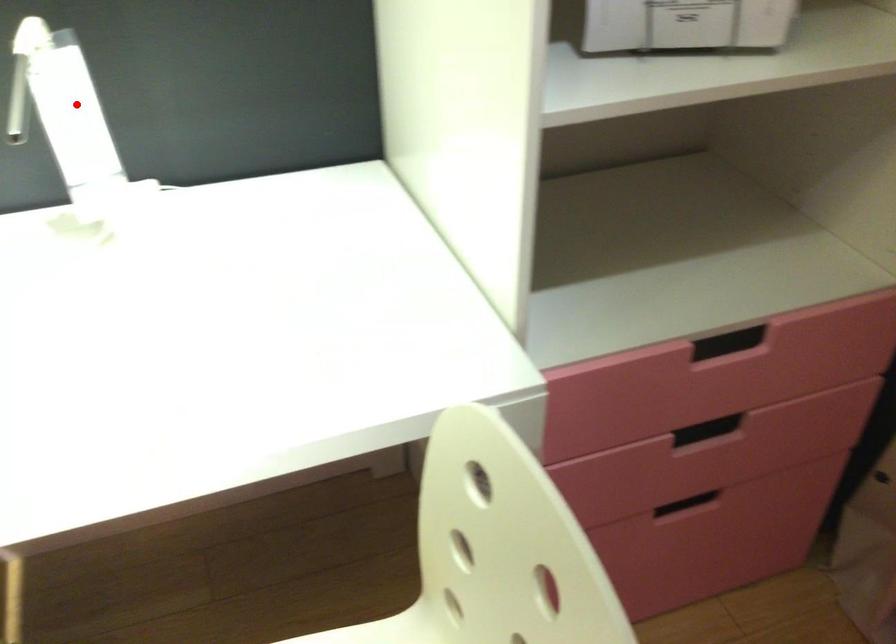
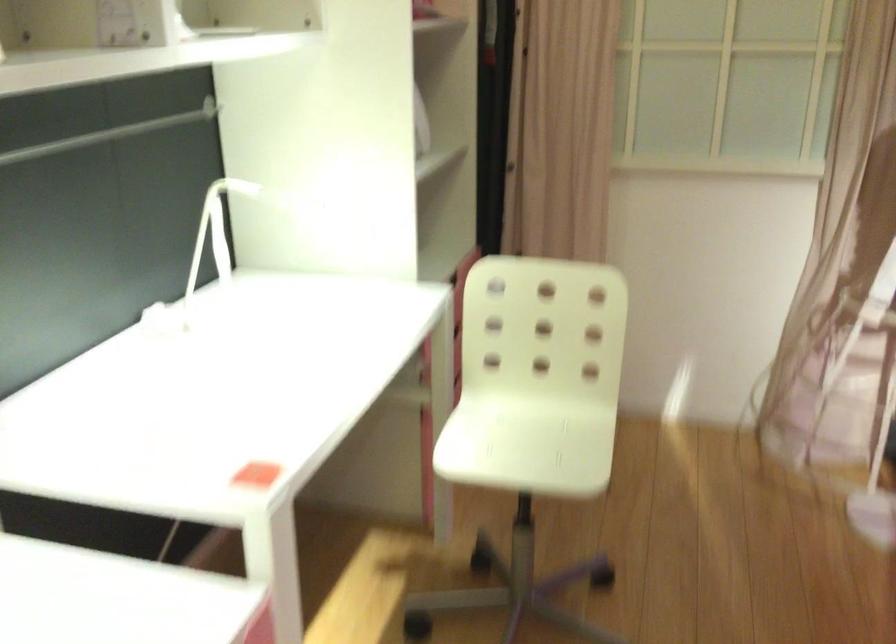
Question: I am providing you with two images of the same scene from different viewpoints. Given a red point in image1, look at the same physical point in image2. Is it:

Choices:
 (A) Closer to the viewpoint
 (B) Farther from the viewpoint

Answer: (B)